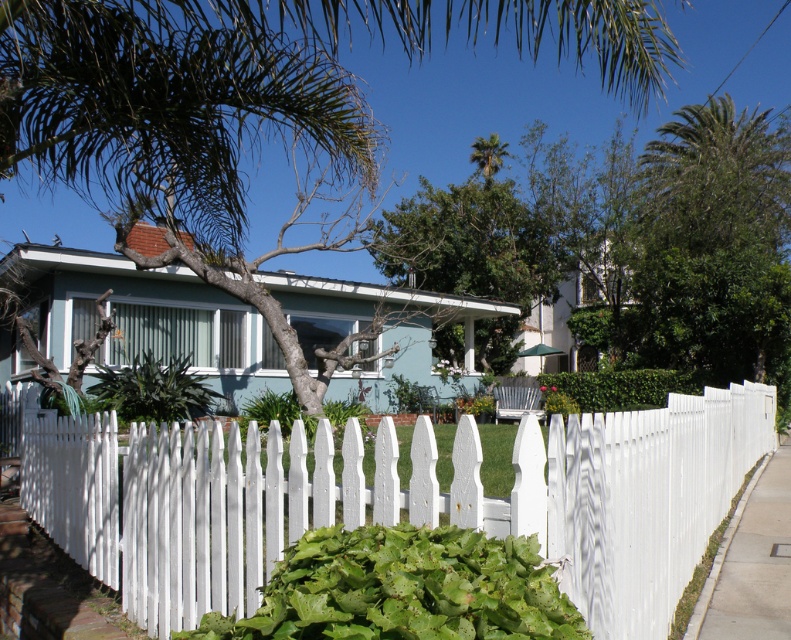
Question: Based on their relative distances, which object is farther from the green leafy tree at center?

Choices:
 (A) white picket fence at center
 (B) green leafy palm tree at upper center
 (C) smooth concrete sidewalk at lower right

Answer: (C)

Question: Which point is closer to the camera?

Choices:
 (A) (475, 145)
 (B) (154, 195)
 (C) (176, 522)
 (D) (782, 499)

Answer: (C)

Question: Is white picket fence at center behind smooth concrete sidewalk at lower right?

Choices:
 (A) yes
 (B) no

Answer: (B)

Question: Observing the image, what is the correct spatial positioning of green leafy tree at center in reference to green leafy palm tree at upper center?

Choices:
 (A) right
 (B) left

Answer: (B)

Question: Among these objects, which one is farthest from the camera?

Choices:
 (A) white picket fence at center
 (B) green leafy tree at center
 (C) green leafy palm tree at upper center
 (D) smooth concrete sidewalk at lower right

Answer: (C)

Question: Is white picket fence at center to the left of green leafy tree at center from the viewer's perspective?

Choices:
 (A) no
 (B) yes

Answer: (A)